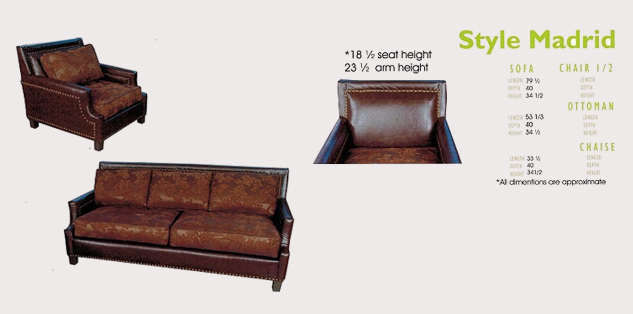
Where is `right back chair leg`? The image size is (633, 314). right back chair leg is located at coordinates (32, 124).